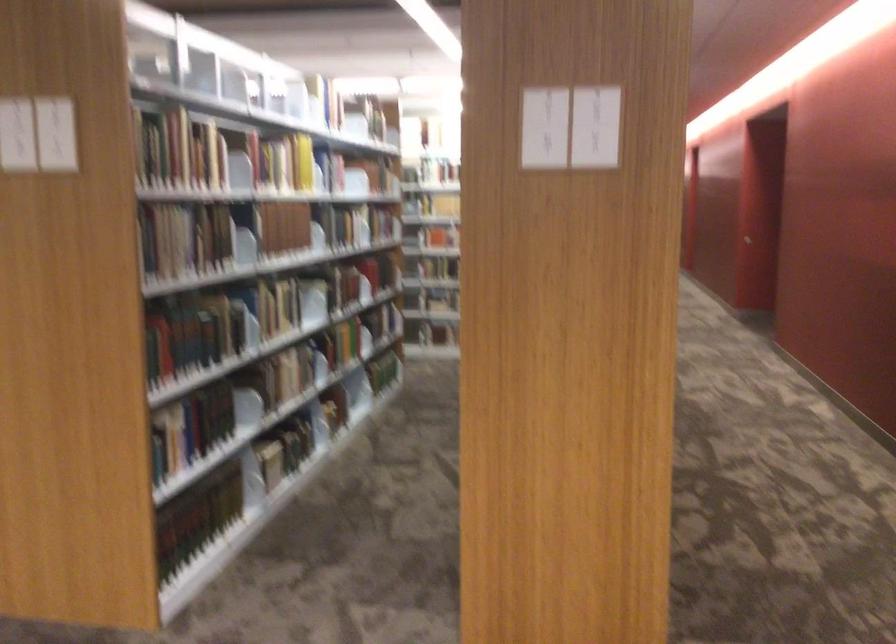
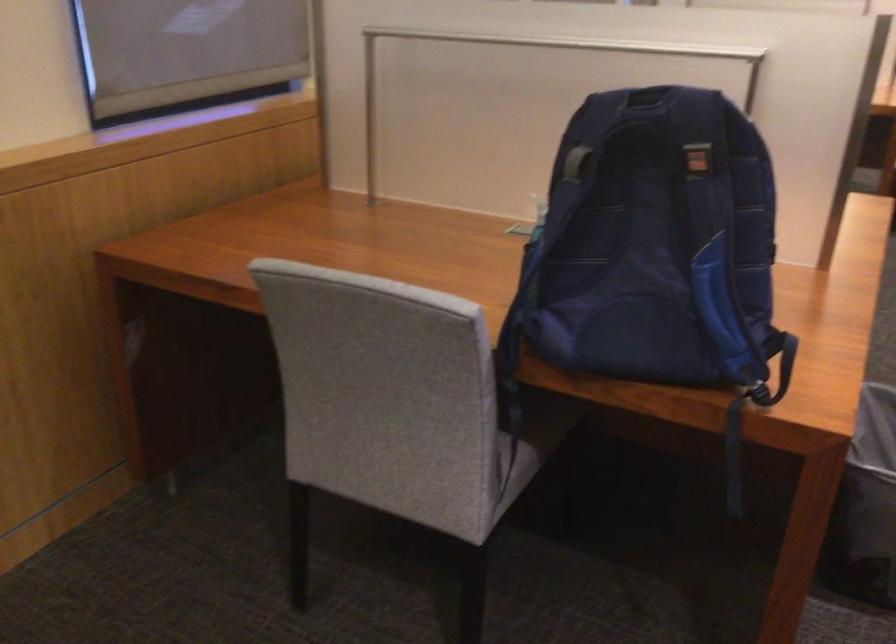
The images are taken continuously from a first-person perspective. In which direction is your viewpoint rotating?

The camera's rotation is toward left-down.